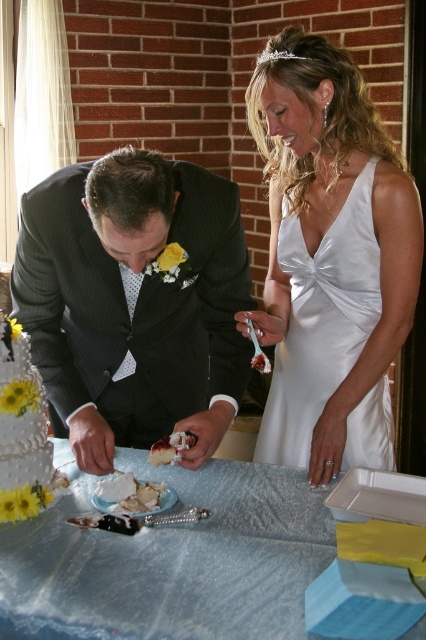
Question: Estimate the real-world distances between objects in this image. Which object is closer to the white cake at center?

Choices:
 (A) dark gray suit at center
 (B) satin white dress at center

Answer: (A)

Question: Is shiny silver table at center above white satin cocktail dress at center?

Choices:
 (A) no
 (B) yes

Answer: (A)

Question: Which point appears farthest from the camera in this image?

Choices:
 (A) (336, 77)
 (B) (328, 342)
 (C) (172, 445)

Answer: (B)

Question: Is dark gray suit at center thinner than white cake at center?

Choices:
 (A) no
 (B) yes

Answer: (A)

Question: Is shiny silver table at center bigger than white cake at center?

Choices:
 (A) no
 (B) yes

Answer: (B)

Question: Which of the following is the farthest from the observer?

Choices:
 (A) shiny silver table at center
 (B) white textured cake at lower left
 (C) white cake at center

Answer: (C)